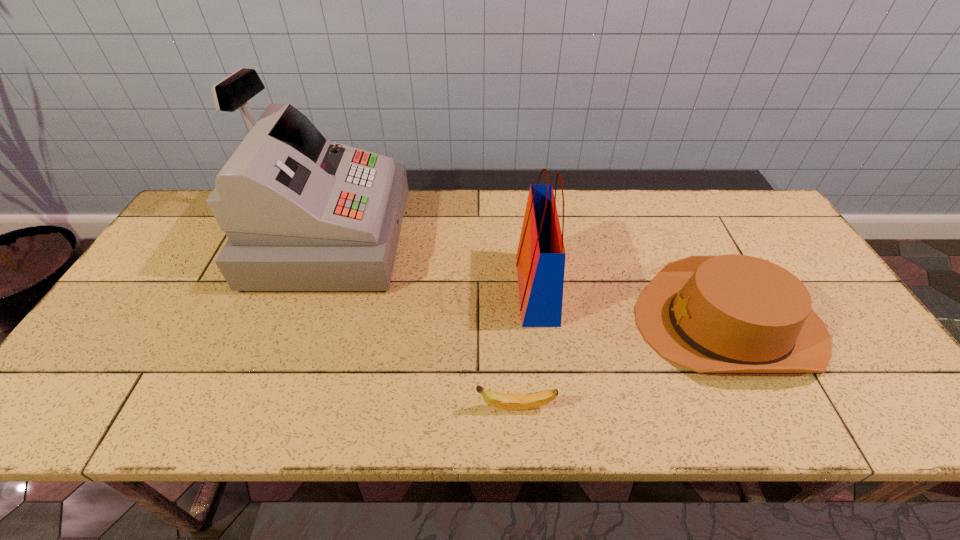
You are a GUI agent. You are given a task and a screenshot of the screen. Output one action in this format:
    pyautogui.click(x=<x>, y=<y>)
    Task: Click on the leftmost object
    
    Given the screenshot: What is the action you would take?
    pyautogui.click(x=302, y=213)

I want to click on shopping bag, so click(x=540, y=258).

Identify the location of the third tallest object. The image size is (960, 540). (732, 313).

Image resolution: width=960 pixels, height=540 pixels. I want to click on cowboy hat, so click(732, 313).

Where is `banana`? Image resolution: width=960 pixels, height=540 pixels. banana is located at coordinates (504, 401).

Identify the location of the shortest object. Image resolution: width=960 pixels, height=540 pixels. (504, 401).

Locate an element on the screen. The image size is (960, 540). blank area located on the keypad side of the leftmost object is located at coordinates (488, 238).

The width and height of the screenshot is (960, 540). Find the location of `blank space located on the handle side of the third shortest object`. blank space located on the handle side of the third shortest object is located at coordinates (386, 290).

You are a GUI agent. You are given a task and a screenshot of the screen. Output one action in this format:
    pyautogui.click(x=<x>, y=<y>)
    Task: Click on the vacant region located 0.270m on the handle side of the third shortest object
    The height and width of the screenshot is (540, 960).
    Given the screenshot: What is the action you would take?
    pyautogui.click(x=416, y=290)

I want to click on vacant space located on the handle side of the third shortest object, so click(x=449, y=290).